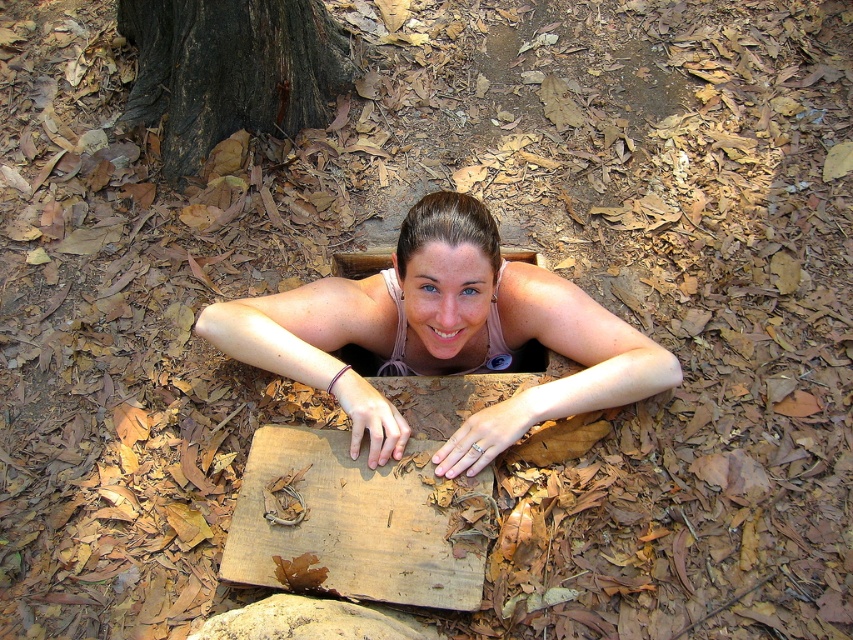
Based on the photo, can you confirm if matte pink tank top at center is positioned above brown rough bark at upper center?

No, matte pink tank top at center is not above brown rough bark at upper center.

Does matte pink tank top at center appear on the left side of brown rough bark at upper center?

In fact, matte pink tank top at center is to the right of brown rough bark at upper center.

Locate an element on the screen. The height and width of the screenshot is (640, 853). matte pink tank top at center is located at coordinates (444, 336).

Can you confirm if wooden plank at center is bigger than brown rough bark at upper center?

No, wooden plank at center is not bigger than brown rough bark at upper center.

Does wooden plank at center have a lesser height compared to brown rough bark at upper center?

Indeed, wooden plank at center has a lesser height compared to brown rough bark at upper center.

Is point (328, 488) more distant than point (186, 100)?

No, (328, 488) is in front of (186, 100).

Identify the location of wooden plank at center. (349, 525).

Which is behind, point (635, 387) or point (341, 483)?

Point (635, 387)

Does point (428, 209) lie behind point (236, 531)?

Yes, it is behind point (236, 531).

Between point (593, 378) and point (393, 532), which one is positioned behind?

The point (593, 378) is behind.

Identify the location of matte pink tank top at center. The height and width of the screenshot is (640, 853). (444, 336).